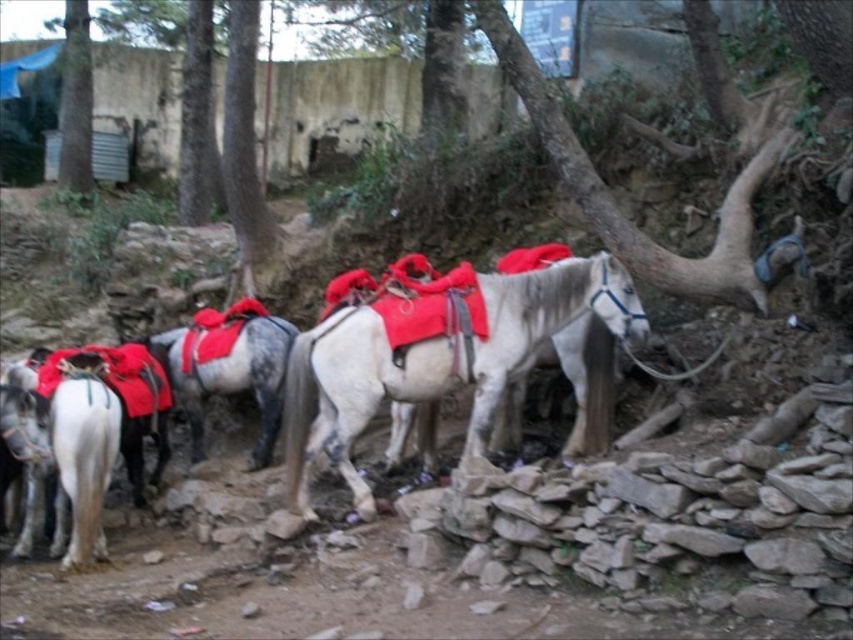
Question: Is white glossy horse at left thinner than white glossy horse at center?

Choices:
 (A) no
 (B) yes

Answer: (B)

Question: Which object is the closest to the white matte horse at center?

Choices:
 (A) green rough bark tree at upper center
 (B) brown rough tree at upper left
 (C) white glossy horse at center
 (D) white glossy horse at left

Answer: (C)

Question: Which of the following is the closest to the observer?

Choices:
 (A) rough bark tree at center right
 (B) white matte horse at center
 (C) brown rough tree at upper left

Answer: (A)

Question: In this image, where is white matte horse at center located relative to white glossy horse at left?

Choices:
 (A) left
 (B) right

Answer: (B)

Question: Does white matte horse at center appear on the left side of white glossy horse at left?

Choices:
 (A) no
 (B) yes

Answer: (A)

Question: Which point appears farthest from the camera in this image?

Choices:
 (A) (86, 10)
 (B) (260, 220)
 (C) (354, 413)

Answer: (A)